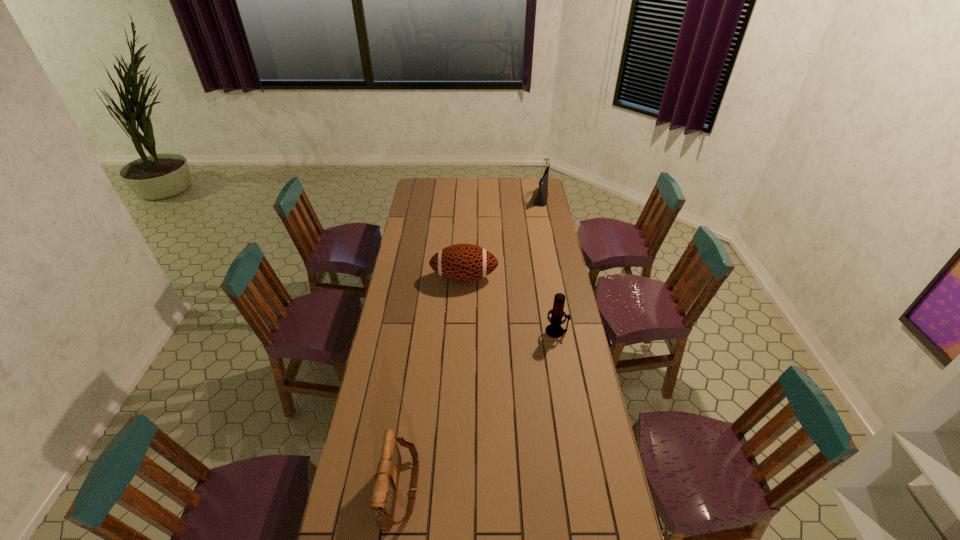
At what (x,y) coordinates should I click in order to perform the action: click on object at the far edge. Please return your answer as a coordinate pair (x, y). Looking at the image, I should click on (540, 200).

What are the coordinates of `object that is at the left edge` in the screenshot? It's located at (384, 494).

The height and width of the screenshot is (540, 960). In order to click on shoulder bag present at the right edge in this screenshot , I will do `click(540, 200)`.

The width and height of the screenshot is (960, 540). Identify the location of microphone that is at the right edge. (554, 330).

Find the location of a particular element. Image resolution: width=960 pixels, height=540 pixels. object that is at the far right corner is located at coordinates (540, 200).

The image size is (960, 540). Find the location of `vacant space at the far edge`. vacant space at the far edge is located at coordinates (472, 180).

In the image, there is a desktop. At what (x,y) coordinates should I click in order to perform the action: click on blank space at the left edge. Please return your answer as a coordinate pair (x, y). The height and width of the screenshot is (540, 960). Looking at the image, I should click on (367, 477).

I want to click on blank space at the right edge, so click(x=538, y=237).

Where is `vacant region at the far left corner of the desktop`? vacant region at the far left corner of the desktop is located at coordinates (425, 178).

Find the location of a particular element. The height and width of the screenshot is (540, 960). unoccupied position between the nearest object and the third farthest object is located at coordinates tap(479, 410).